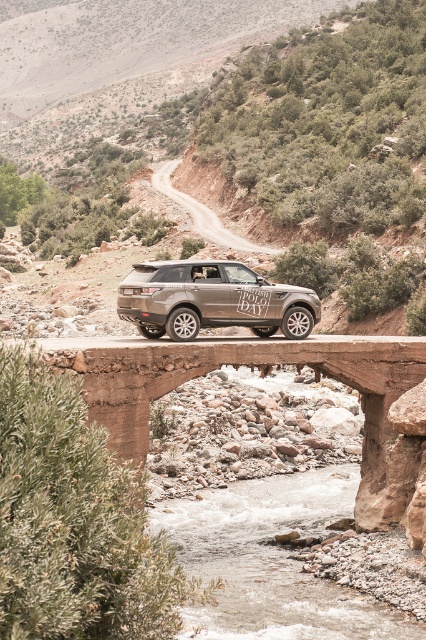
You are driving a car and need to cross the bridge shown in the image. The bridge has a clear water at center and a smooth gravel road at center. Which one is located to the right side of the other?

The clear water at center is located to the right of the smooth gravel road at center according to the description.

You are standing on the stone bridge and see the point marked at coordinates (271, 561). What is the location of this point relative to the clear water at center?

The point at coordinates (271, 561) is located on the clear water at center.

You are a photographer standing on the stone bridge and want to capture both the matte metallic suv at center and the smooth gravel road at center in your photo. Which object will appear larger in the photo?

The matte metallic suv at center will appear larger in the photo because it is closer to the viewer than the smooth gravel road at center.